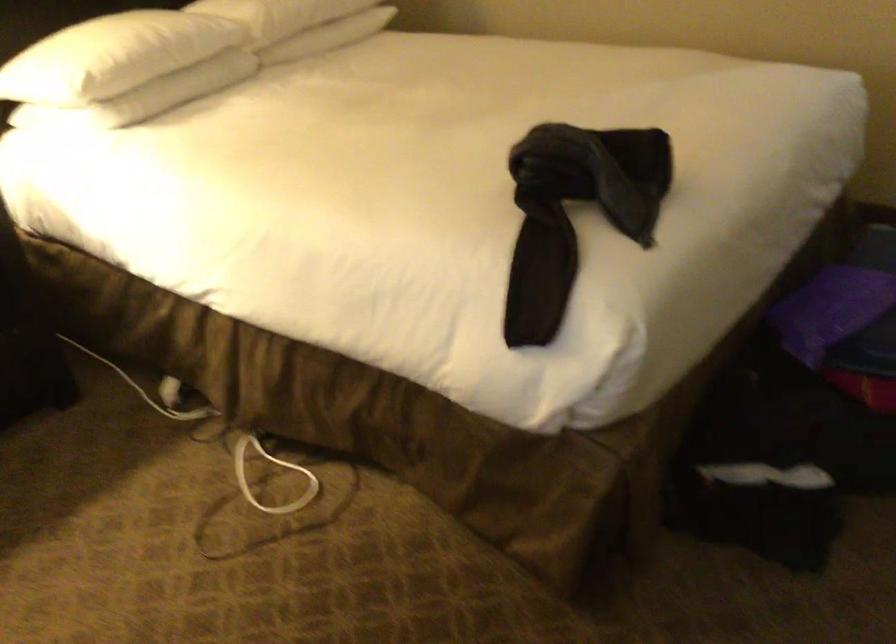
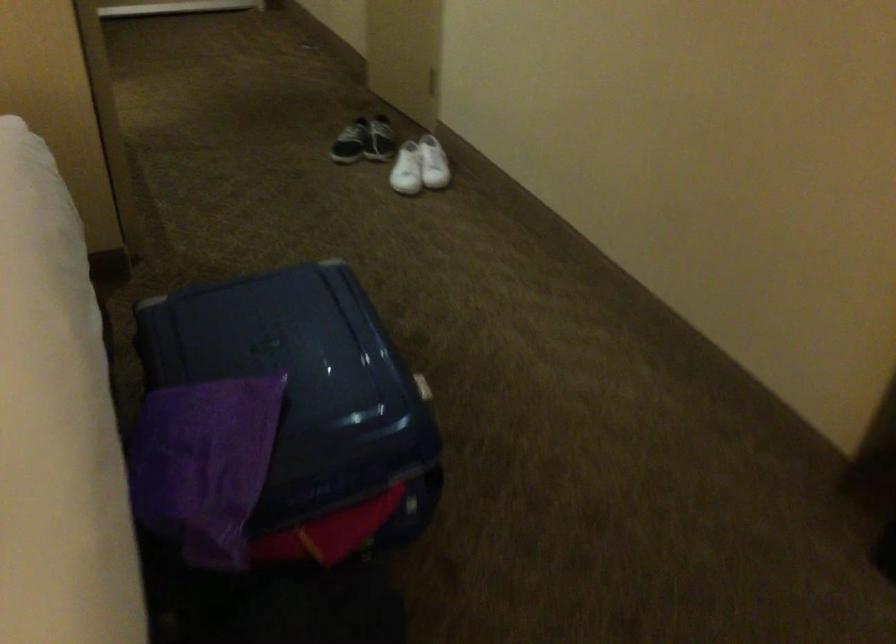
Question: The camera is either moving clockwise (left) or counter-clockwise (right) around the object. The first image is from the beginning of the video and the second image is from the end. Is the camera moving left or right when shooting the video?

Choices:
 (A) Left
 (B) Right

Answer: (A)